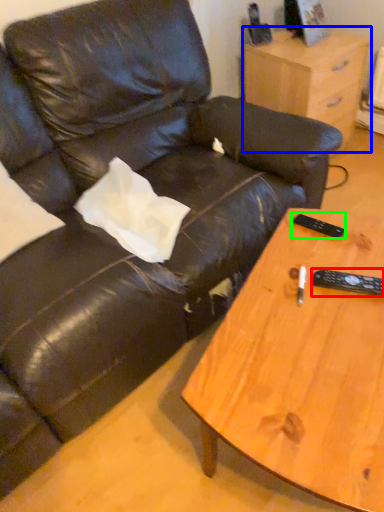
Question: Estimate the real-world distances between objects in this image. Which object is farther from remote (highlighted by a red box), nightstand (highlighted by a blue box) or remote (highlighted by a green box)?

Choices:
 (A) nightstand
 (B) remote

Answer: (A)